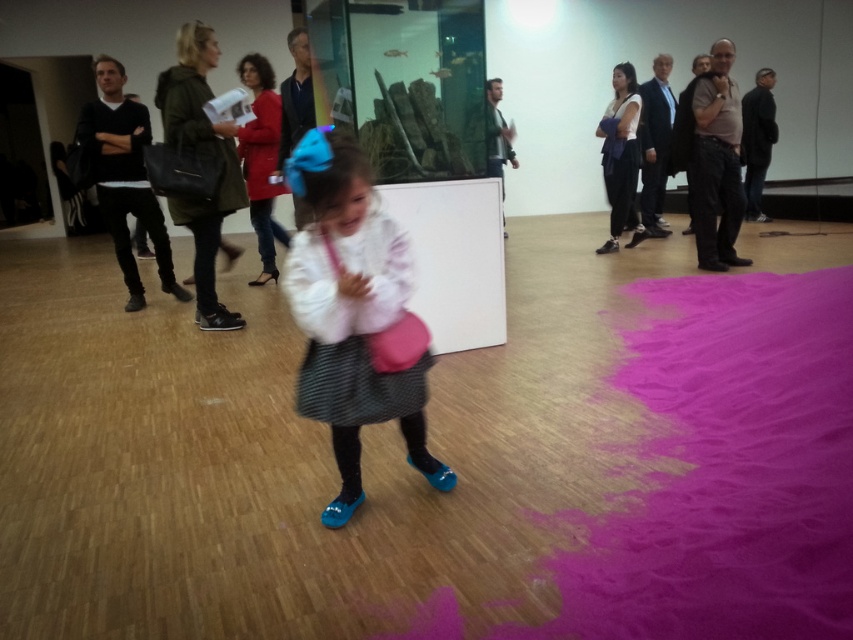
Based on the photo, you are an event organizer planning to hang a decorative banner between the green matte jacket at upper left and the black leather jacket at left. Which jacket requires the banner to be placed closer to the narrower side?

The green matte jacket at upper left has a lesser width compared to the black leather jacket at left, so the banner should be placed closer to the green matte jacket at upper left to accommodate its narrower side.

You are an event organizer who needs to arrange two coats on a display rack. You have the black leather jacket at left and the red wool coat at center. Based on their sizes, which one should you place first on the rack to ensure both fit properly?

The black leather jacket at left is wider than the red wool coat at center, so you should place the black leather jacket at left first to accommodate its larger width before adding the red wool coat at center.

You are standing in the art gallery and notice two items of clothing. One is the matte white blouse at center and the other is the black leather jacket at left. Which one is nearer to you?

The matte white blouse at center is closer to the viewer than the black leather jacket at left.